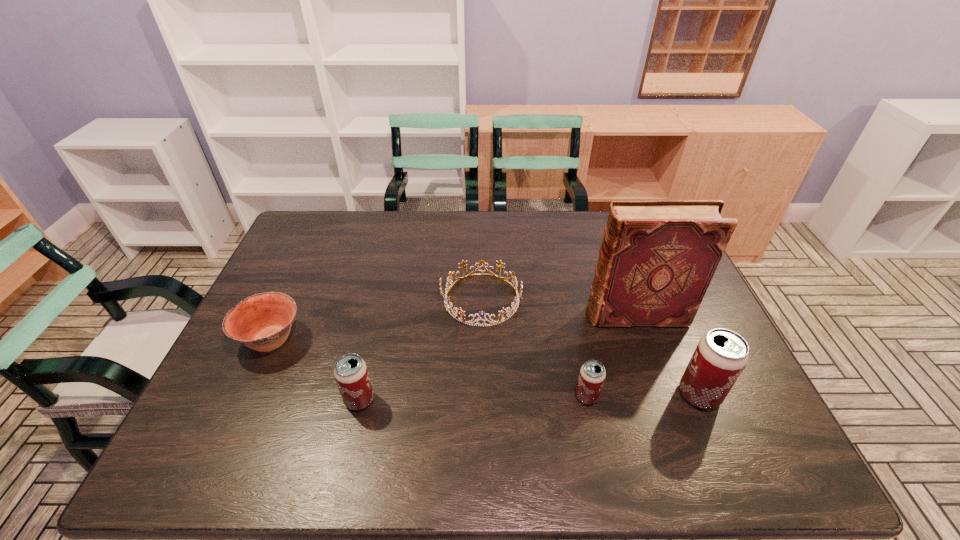
Find the location of `free location located 0.320m on the left of the second tallest beer can`. free location located 0.320m on the left of the second tallest beer can is located at coordinates (211, 400).

Locate an element on the screen. The width and height of the screenshot is (960, 540). free region located 0.320m on the left of the shortest beer can is located at coordinates (442, 396).

Find the location of a particular element. The width and height of the screenshot is (960, 540). free space located 0.060m on the right of the fifth shortest object is located at coordinates (745, 394).

The image size is (960, 540). Identify the location of free space located on the spine side of the tallest object. (481, 315).

Locate an element on the screen. Image resolution: width=960 pixels, height=540 pixels. vacant area situated on the spine side of the tallest object is located at coordinates (530, 315).

At what (x,y) coordinates should I click in order to perform the action: click on vacant space situated on the spine side of the tallest object. Please return your answer as a coordinate pair (x, y). This screenshot has width=960, height=540. Looking at the image, I should click on (502, 315).

Locate an element on the screen. This screenshot has width=960, height=540. free location located on the front-facing side of the tiara is located at coordinates (418, 299).

The image size is (960, 540). I want to click on free space located 0.140m on the front-facing side of the tiara, so click(x=394, y=299).

Locate an element on the screen. vacant space located 0.080m on the front-facing side of the tiara is located at coordinates (414, 299).

At what (x,y) coordinates should I click in order to perform the action: click on free space located on the front of the bowl. Please return your answer as a coordinate pair (x, y). This screenshot has height=540, width=960. Looking at the image, I should click on (237, 415).